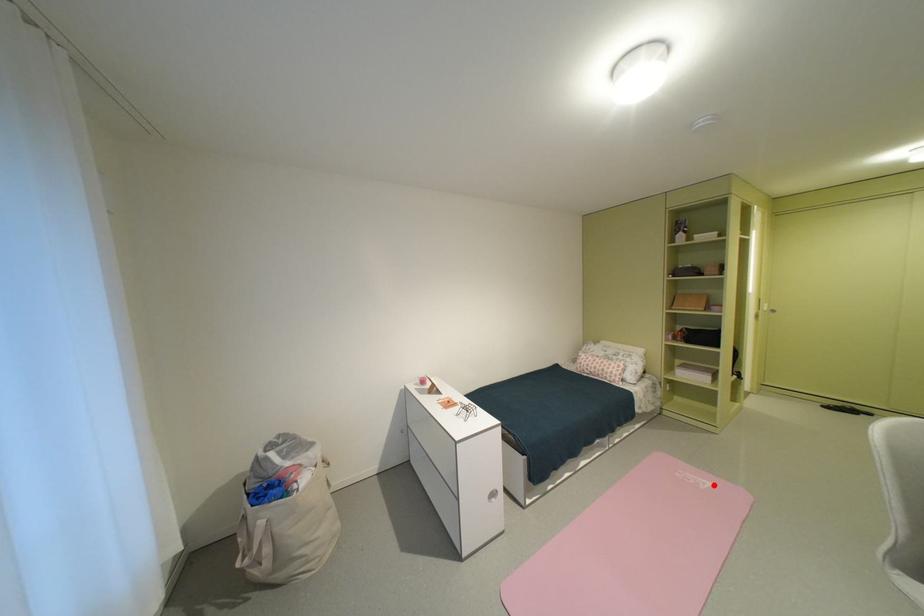
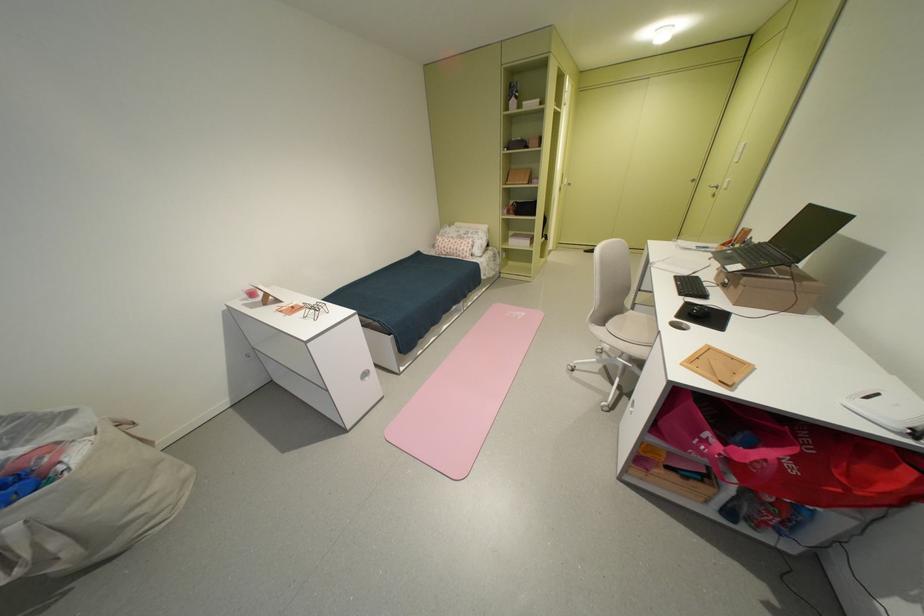
In the second image, find the point that corresponds to the highlighted location in the first image.

(530, 315)